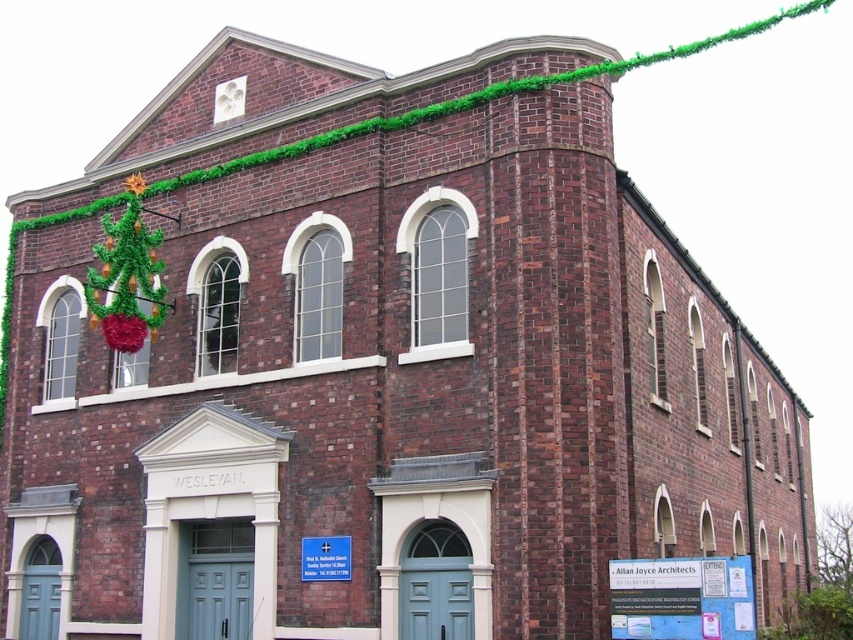
Question: Is green garland at upper center bigger than shiny tinsel christmas tree at left?

Choices:
 (A) yes
 (B) no

Answer: (A)

Question: Considering the relative positions of green garland at upper center and shiny tinsel christmas tree at left in the image provided, where is green garland at upper center located with respect to shiny tinsel christmas tree at left?

Choices:
 (A) below
 (B) above

Answer: (B)

Question: Which of the following is the farthest from the observer?

Choices:
 (A) shiny tinsel christmas tree at left
 (B) green garland at upper center

Answer: (A)

Question: Is green garland at upper center above shiny tinsel christmas tree at left?

Choices:
 (A) no
 (B) yes

Answer: (B)

Question: Which of the following is the closest to the observer?

Choices:
 (A) click(119, 301)
 (B) click(625, 60)

Answer: (A)